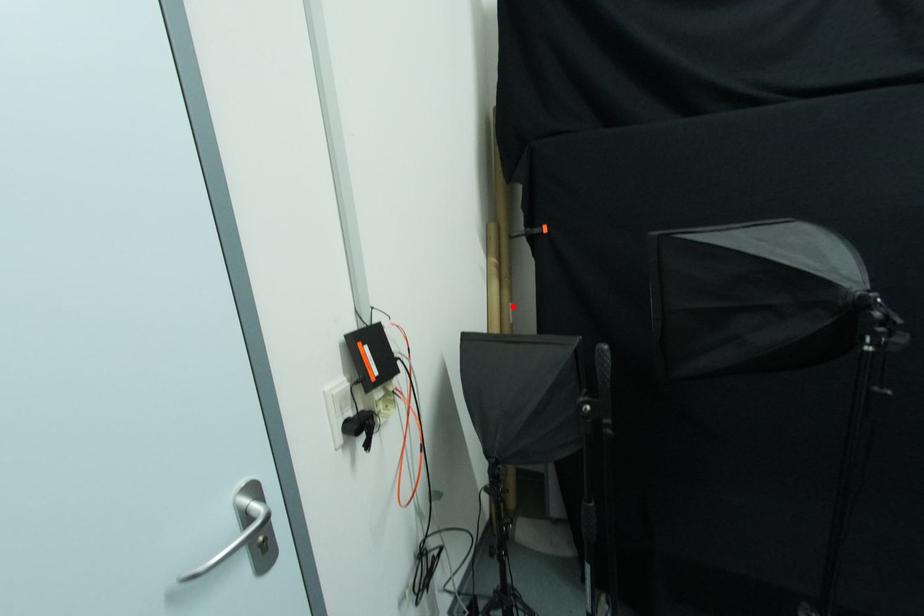
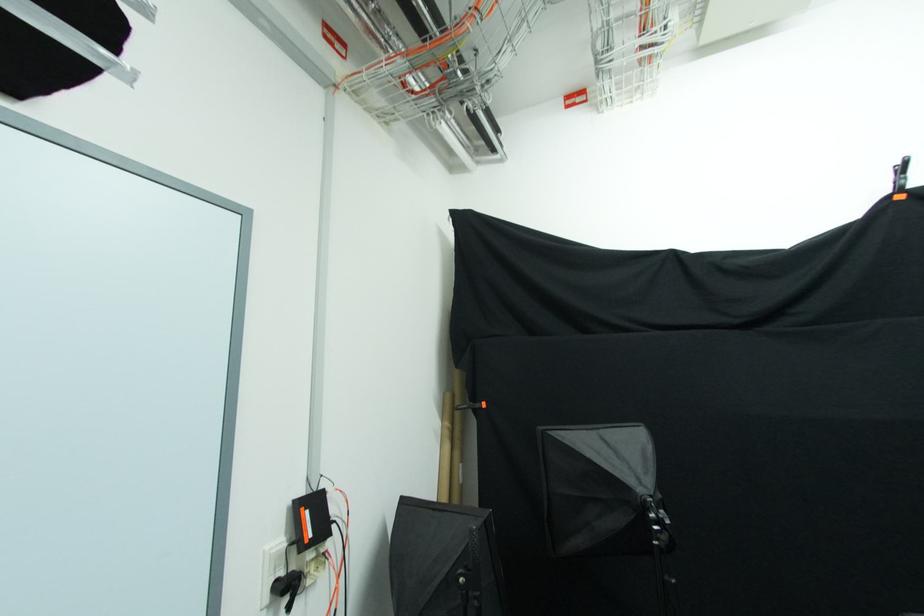
Question: I am providing you with two images of the same scene from different viewpoints. A red point is marked on the first image. Is the red point's position out of view in image 2?

Choices:
 (A) Yes
 (B) No

Answer: (B)